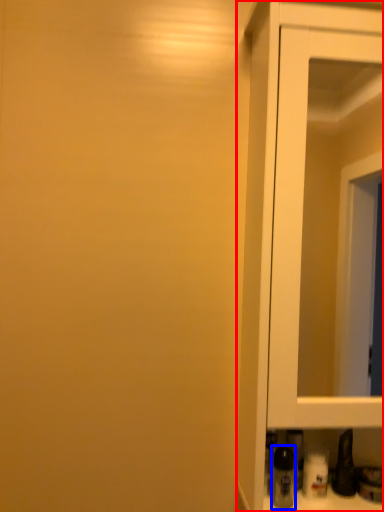
Question: Which object is closer to the camera taking this photo, cupboard (highlighted by a red box) or bottle (highlighted by a blue box)?

Choices:
 (A) cupboard
 (B) bottle

Answer: (A)